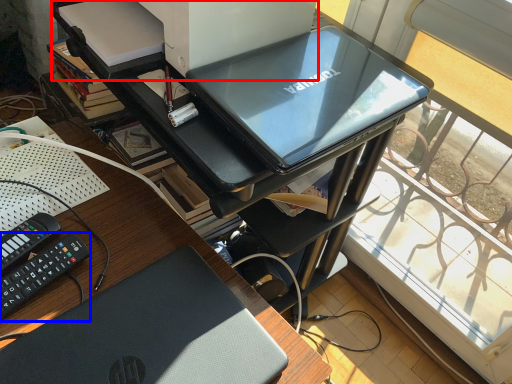
Question: Which of the following is the farthest to the observer, printer (highlighted by a red box) or equipment (highlighted by a blue box)?

Choices:
 (A) printer
 (B) equipment

Answer: (A)